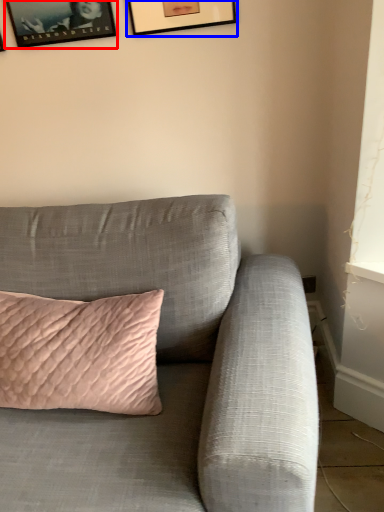
Question: Which object appears farthest to the camera in this image, picture frame (highlighted by a red box) or picture frame (highlighted by a blue box)?

Choices:
 (A) picture frame
 (B) picture frame

Answer: (A)